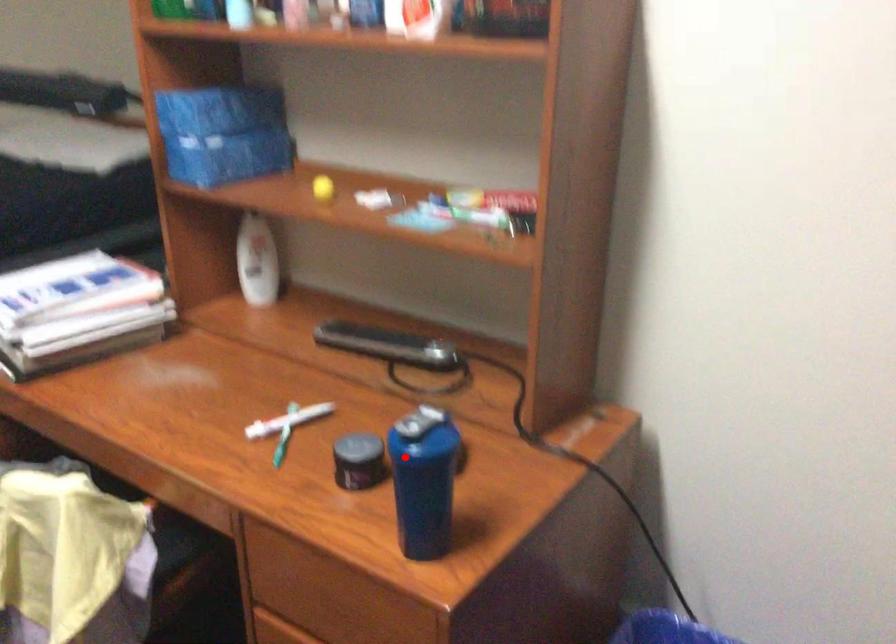
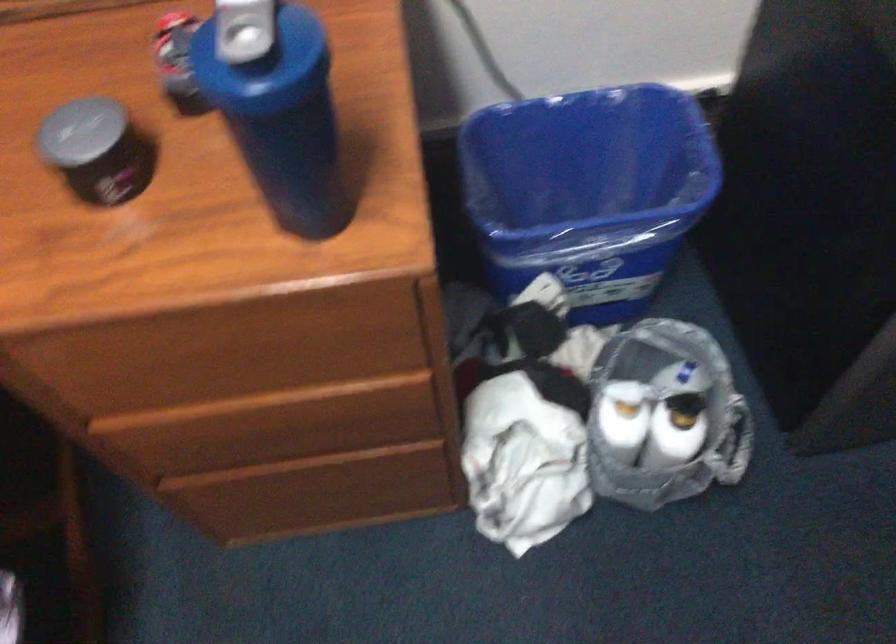
Find the pixel in the second image that matches the highlighted location in the first image.

(264, 102)